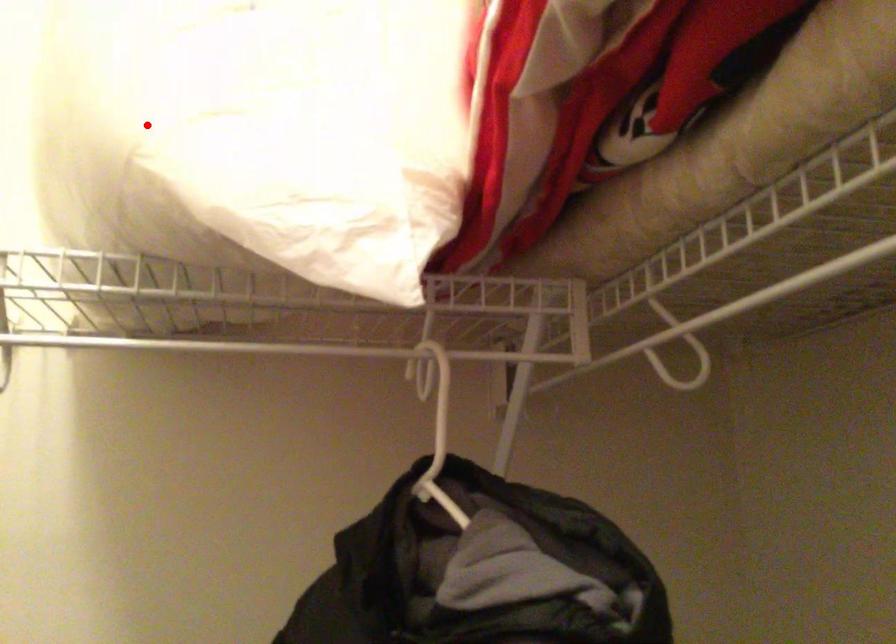
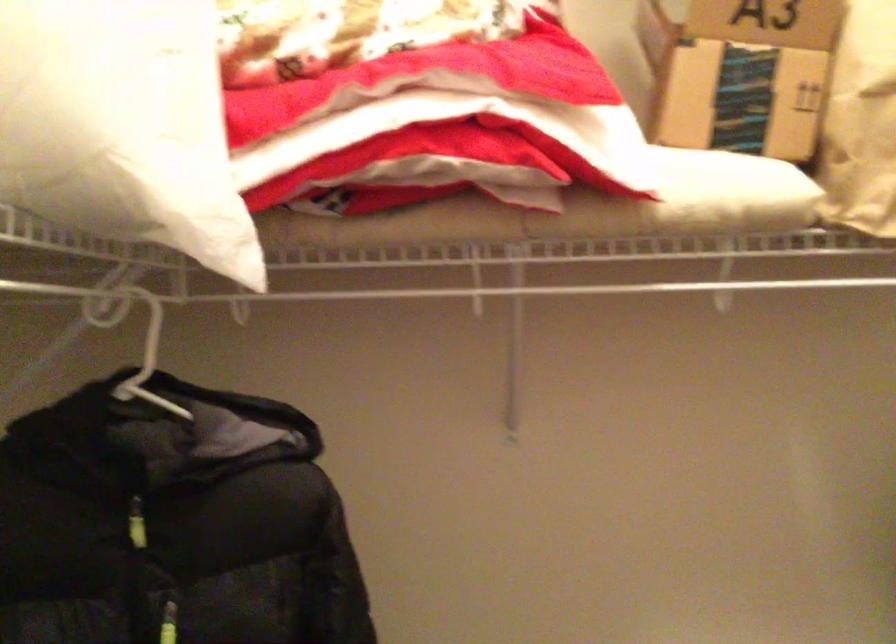
Find the pixel in the second image that matches the highlighted location in the first image.

(123, 126)